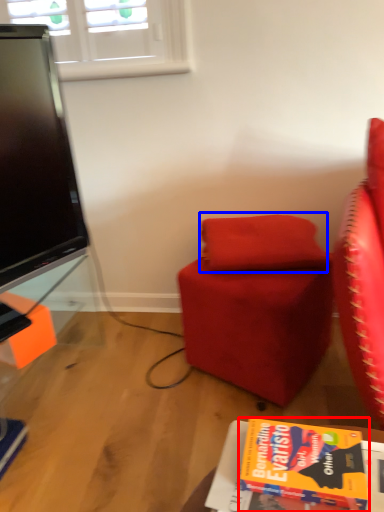
Question: Among these objects, which one is nearest to the camera, book (highlighted by a red box) or pillow (highlighted by a blue box)?

Choices:
 (A) book
 (B) pillow

Answer: (A)